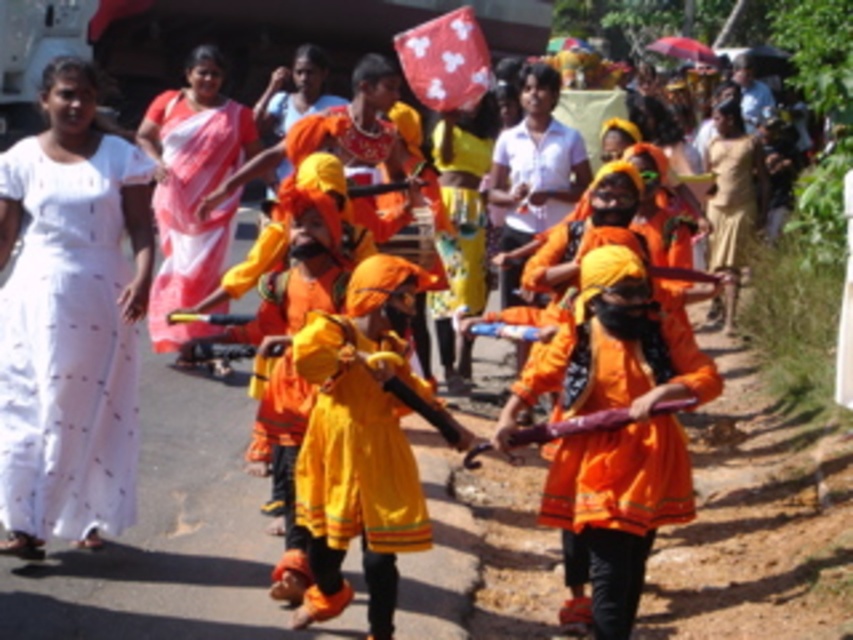
You are a photographer at this event and want to capture both the matte orange dress at center and the white silk saree at upper left in a single frame. Which one should you focus on first to ensure both are in the frame?

The matte orange dress at center is smaller than the white silk saree at upper left, so you should focus on the white silk saree at upper left first to ensure both are in the frame.

You are standing in the crowd watching the procession and want to take a photo of both the point at coordinates point(132, 328) and point(347, 413). Which point is closer to you?

The point at coordinates point(132, 328) is closer to you because it is further to the viewer than point(347, 413).

You are a photographer trying to capture the cultural procession. You notice the white silk saree at upper left and the brown cotton saree at right. Which saree is closer to the camera?

The white silk saree at upper left is closer to the camera because it is in front of the brown cotton saree at right.